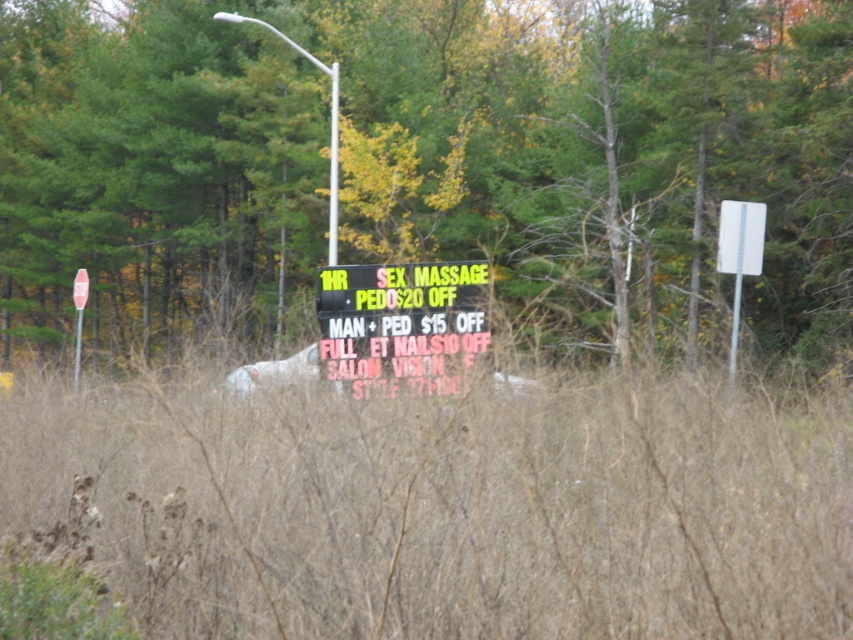
Can you confirm if brown dry grass at center is shorter than black plastic sign at center?

Yes, brown dry grass at center is shorter than black plastic sign at center.

Which is behind, point (380, 486) or point (328, 372)?

Positioned behind is point (328, 372).

At what (x,y) coordinates should I click in order to perform the action: click on brown dry grass at center. Please return your answer as a coordinate pair (x, y). Looking at the image, I should click on (448, 506).

Where is `brown dry grass at center`? brown dry grass at center is located at coordinates (448, 506).

Does green leafy tree at center lie in front of brown dry grass at center?

No.

Who is higher up, green leafy tree at center or brown dry grass at center?

green leafy tree at center

Does point (830, 355) come closer to viewer compared to point (136, 550)?

No, it is behind (136, 550).

Find the location of `green leafy tree at center`. green leafy tree at center is located at coordinates (428, 163).

Between green leafy tree at center and black plastic sign at center, which one appears on the right side from the viewer's perspective?

black plastic sign at center is more to the right.

Does green leafy tree at center have a smaller size compared to black plastic sign at center?

Incorrect, green leafy tree at center is not smaller in size than black plastic sign at center.

Is point (766, 38) more distant than point (454, 298)?

Yes, it is.

The image size is (853, 640). I want to click on green leafy tree at center, so click(428, 163).